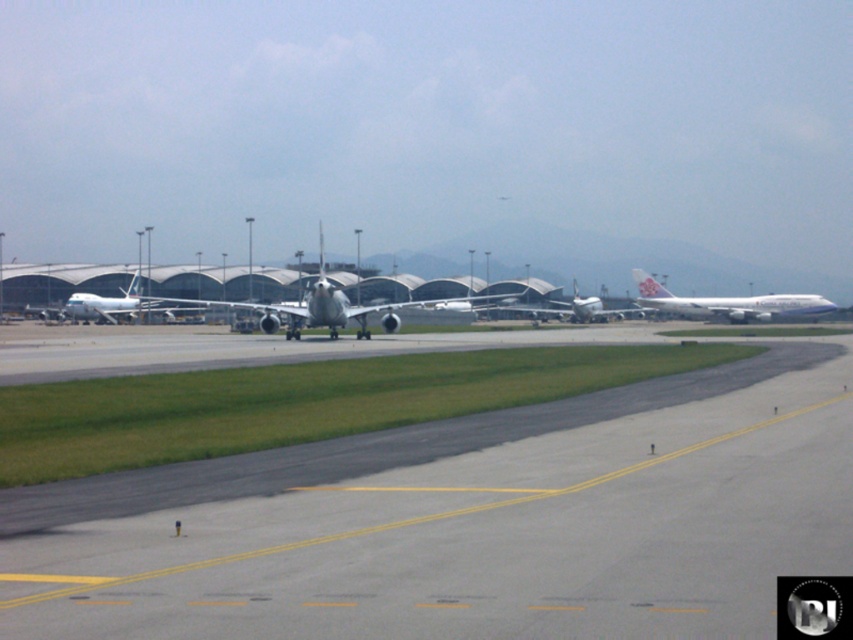
Is silver metallic airplane at center thinner than metallic silver airplane at center?

No, silver metallic airplane at center is not thinner than metallic silver airplane at center.

Which is behind, point (399, 305) or point (105, 298)?

The point (105, 298) is behind.

Is point (318, 320) more distant than point (138, 278)?

No, (318, 320) is closer to viewer.

This screenshot has width=853, height=640. What are the coordinates of `silver metallic airplane at center` in the screenshot? It's located at (328, 308).

Does point (345, 294) come behind point (740, 308)?

No, (345, 294) is in front of (740, 308).

Which is in front, point (320, 324) or point (770, 312)?

Positioned in front is point (320, 324).

Identify the location of silver metallic airplane at center. This screenshot has width=853, height=640. (328, 308).

Where is `silver metallic airplane at center`? The image size is (853, 640). silver metallic airplane at center is located at coordinates (328, 308).

Is point (364, 333) closer to viewer compared to point (621, 314)?

Yes, it is in front of point (621, 314).

Is point (312, 291) farther from camera compared to point (636, 314)?

No, it is in front of (636, 314).

Where is `silver metallic airplane at center`? Image resolution: width=853 pixels, height=640 pixels. silver metallic airplane at center is located at coordinates (328, 308).